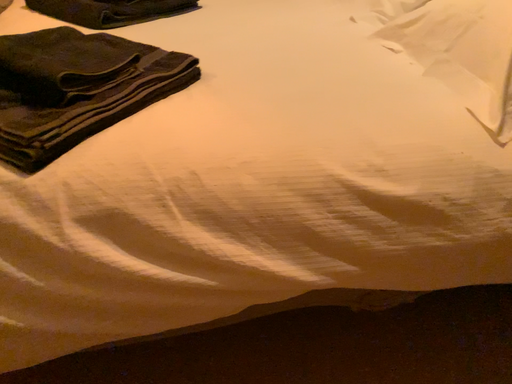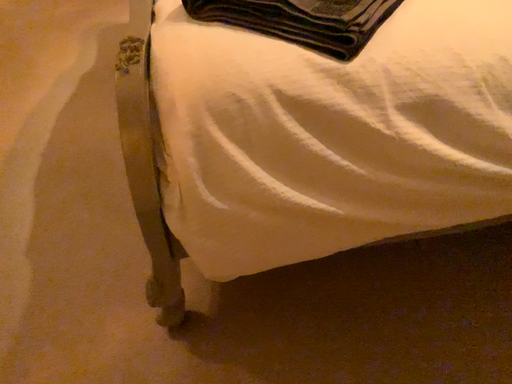
Question: How did the camera likely rotate when shooting the video?

Choices:
 (A) rotated downward
 (B) rotated upward

Answer: (A)